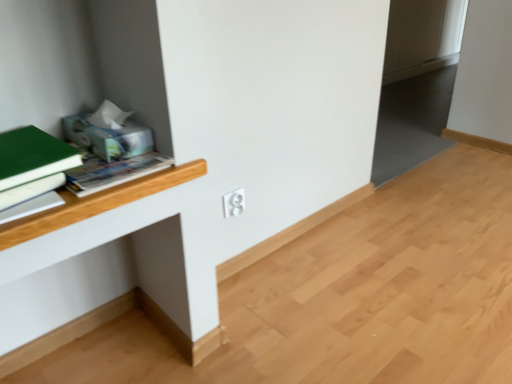
What do you see at coordinates (32, 164) in the screenshot?
I see `green matte book at left` at bounding box center [32, 164].

Describe the element at coordinates (234, 203) in the screenshot. I see `white plastic electric outlet at center` at that location.

Describe the element at coordinates (96, 203) in the screenshot. I see `white matte computer desk at center` at that location.

Find the location of a particular element. This screenshot has width=512, height=384. white matte book at left is located at coordinates [30, 190].

Considering the relative positions of white plastic electric outlet at center and white matte computer desk at center in the image provided, is white plastic electric outlet at center to the left of white matte computer desk at center from the viewer's perspective?

Yes, white plastic electric outlet at center is to the left of white matte computer desk at center.

How different are the orientations of white plastic electric outlet at center and white matte computer desk at center in degrees?

The angular difference between white plastic electric outlet at center and white matte computer desk at center is 0.49 degrees.

Does white plastic electric outlet at center have a lesser width compared to white matte computer desk at center?

Incorrect, the width of white plastic electric outlet at center is not less than that of white matte computer desk at center.

From the image's perspective, is white plastic electric outlet at center on top of white matte computer desk at center?

Yes, from the image's perspective, white plastic electric outlet at center is above white matte computer desk at center.

From the image's perspective, would you say white matte computer desk at center is shown under white plastic electric outlet at center?

Yes, from the image's perspective, white matte computer desk at center is below white plastic electric outlet at center.

From the picture: Can you confirm if white matte computer desk at center is taller than white plastic electric outlet at center?

No, white matte computer desk at center is not taller than white plastic electric outlet at center.

Consider the image. From a real-world perspective, is white matte computer desk at center positioned above or below white plastic electric outlet at center?

Clearly, from a real-world perspective, white matte computer desk at center is below white plastic electric outlet at center.

Based on the photo, how many degrees apart are the facing directions of white matte computer desk at center and white plastic electric outlet at center?

The facing directions of white matte computer desk at center and white plastic electric outlet at center are 0.49 degrees apart.

Considering the sizes of objects white matte computer desk at center and green matte book at left in the image provided, who is smaller, white matte computer desk at center or green matte book at left?

Smaller between the two is white matte computer desk at center.

Can green matte book at left be found inside white matte computer desk at center?

No, white matte computer desk at center does not contain green matte book at left.

Considering the sizes of objects white matte computer desk at center and green matte book at left in the image provided, who is wider, white matte computer desk at center or green matte book at left?

With larger width is green matte book at left.

Consider the image. Is white matte computer desk at center in front of green matte book at left?

No, the depth of white matte computer desk at center is greater than that of green matte book at left.

From a real-world perspective, is green matte book at left physically located above or below white plastic electric outlet at center?

Clearly, from a real-world perspective, green matte book at left is above white plastic electric outlet at center.

Between green matte book at left and white plastic electric outlet at center, which one has larger size?

Bigger between the two is green matte book at left.

Is white plastic electric outlet at center surrounded by green matte book at left?

That's incorrect, white plastic electric outlet at center is not inside green matte book at left.

Is white matte book at left situated inside white plastic electric outlet at center or outside?

The correct answer is: outside.

How different are the orientations of white matte book at left and white plastic electric outlet at center in degrees?

The facing directions of white matte book at left and white plastic electric outlet at center are 4.06 degrees apart.

The height and width of the screenshot is (384, 512). In order to click on electric outlet located behind the white matte book at left in this screenshot , I will do `click(234, 203)`.

Is white matte book at left at the right side of white plastic electric outlet at center?

Incorrect, white matte book at left is not on the right side of white plastic electric outlet at center.

Does green matte book at left turn towards white matte computer desk at center?

No, green matte book at left is not turned towards white matte computer desk at center.

From a real-world perspective, is green matte book at left on top of white matte computer desk at center?

Correct, in the physical world, green matte book at left is higher than white matte computer desk at center.

Considering their positions, is green matte book at left located in front of or behind white matte computer desk at center?

A: Visually, green matte book at left is located in front of white matte computer desk at center.

Which is less distant, (15, 174) or (125, 183)?

Positioned in front is point (15, 174).

Is white matte book at left looking in the opposite direction of green matte book at left?

That's not correct — white matte book at left is not looking away from green matte book at left.

From the image's perspective, which one is positioned higher, white matte book at left or green matte book at left?

From the image's view, green matte book at left is above.

From a real-world perspective, is white matte book at left positioned over green matte book at left based on gravity?

Actually, white matte book at left is physically below green matte book at left in the real world.

Between white matte book at left and green matte book at left, which one appears on the left side from the viewer's perspective?

From the viewer's perspective, white matte book at left appears more on the left side.

At what (x,y) coordinates should I click in order to perform the action: click on computer desk on the right of white plastic electric outlet at center. Please return your answer as a coordinate pair (x, y). Image resolution: width=512 pixels, height=384 pixels. Looking at the image, I should click on (96, 203).

Where is `computer desk in front of the white plastic electric outlet at center`? This screenshot has height=384, width=512. computer desk in front of the white plastic electric outlet at center is located at coordinates (96, 203).

Estimate the real-world distances between objects in this image. Which object is further from white matte book at left, white plastic electric outlet at center or green matte book at left?

white plastic electric outlet at center is further to white matte book at left.

Based on their spatial positions, is green matte book at left or white matte computer desk at center further from white plastic electric outlet at center?

Based on the image, green matte book at left appears to be further to white plastic electric outlet at center.

Which object lies nearer to the anchor point white matte computer desk at center, white matte book at left or white plastic electric outlet at center?

Among the two, white matte book at left is located nearer to white matte computer desk at center.

When comparing their distances from white matte book at left, does white matte computer desk at center or green matte book at left seem closer?

Based on the image, green matte book at left appears to be nearer to white matte book at left.

Which object lies further to the anchor point green matte book at left, white matte computer desk at center or white matte book at left?

Among the two, white matte computer desk at center is located further to green matte book at left.

Looking at the image, which one is located further to white matte computer desk at center, white plastic electric outlet at center or green matte book at left?

white plastic electric outlet at center is positioned further to the anchor white matte computer desk at center.

From the image, which object appears to be farther from green matte book at left, white matte computer desk at center or white plastic electric outlet at center?

Among the two, white plastic electric outlet at center is located further to green matte book at left.

When comparing their distances from green matte book at left, does white matte book at left or white matte computer desk at center seem further?

Among the two, white matte computer desk at center is located further to green matte book at left.

This screenshot has height=384, width=512. Find the location of `computer desk positioned between green matte book at left and white plastic electric outlet at center from near to far`. computer desk positioned between green matte book at left and white plastic electric outlet at center from near to far is located at coordinates (96, 203).

You are a GUI agent. You are given a task and a screenshot of the screen. Output one action in this format:
    pyautogui.click(x=<x>, y=<y>)
    Task: Click on the paperback book positioned between white matte book at left and white plastic electric outlet at center from near to far
    
    Given the screenshot: What is the action you would take?
    pyautogui.click(x=32, y=164)

At what (x,y) coordinates should I click in order to perform the action: click on computer desk positioned between white matte book at left and white plastic electric outlet at center from near to far. Please return your answer as a coordinate pair (x, y). Looking at the image, I should click on (96, 203).

Locate an element on the screen. This screenshot has width=512, height=384. paperback book between white matte book at left and white matte computer desk at center is located at coordinates (32, 164).